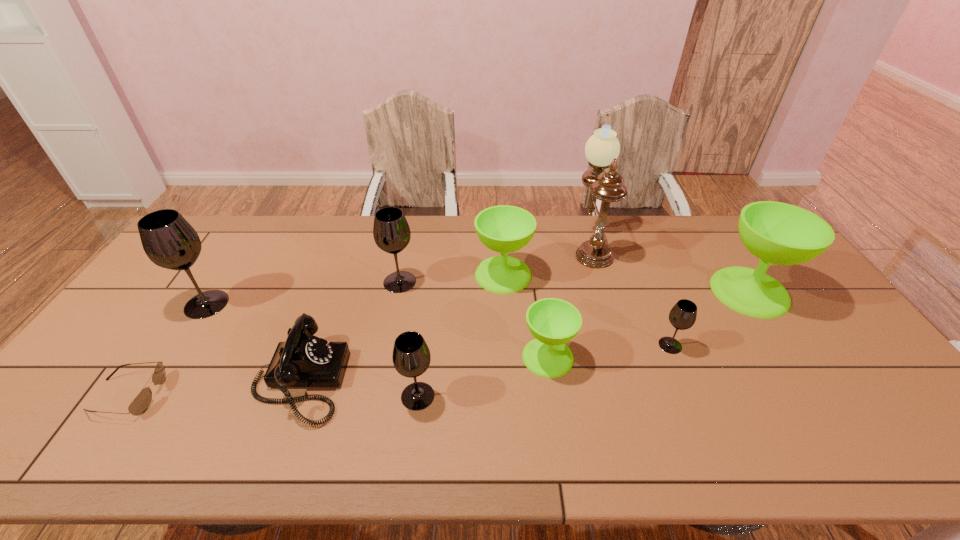
Locate an element on the screen. free spot between the second biggest green wineglass and the telephone is located at coordinates (401, 327).

You are a GUI agent. You are given a task and a screenshot of the screen. Output one action in this format:
    pyautogui.click(x=<x>, y=<y>)
    Task: Click on the empty space between the third farthest gray wineglass and the tallest object
    The image size is (960, 540).
    Given the screenshot: What is the action you would take?
    pyautogui.click(x=631, y=295)

This screenshot has width=960, height=540. In order to click on free space between the rightmost object and the second biggest green wineglass in this screenshot , I will do `click(626, 283)`.

In order to click on empty space between the eighth object from left to right and the third wineglass from left to right in this screenshot , I will do `click(504, 320)`.

Identify which object is located as the second nearest to the sixth wineglass from left to right. Please provide its 2D coordinates. Your answer should be formatted as a tuple, i.e. [(x, y)], where the tuple contains the x and y coordinates of a point satisfying the conditions above.

[(553, 322)]

Select which object appears as the closest to the smallest gray wineglass. Please provide its 2D coordinates. Your answer should be formatted as a tuple, i.e. [(x, y)], where the tuple contains the x and y coordinates of a point satisfying the conditions above.

[(778, 233)]

Where is `the second closest wineglass to the nearest wineglass`? The image size is (960, 540). the second closest wineglass to the nearest wineglass is located at coordinates (391, 231).

Locate which wineglass is the sixth closest to the tallest wineglass. Please provide its 2D coordinates. Your answer should be formatted as a tuple, i.e. [(x, y)], where the tuple contains the x and y coordinates of a point satisfying the conditions above.

[(778, 233)]

Identify which gray wineglass is located as the third nearest to the leftmost gray wineglass. Please provide its 2D coordinates. Your answer should be formatted as a tuple, i.e. [(x, y)], where the tuple contains the x and y coordinates of a point satisfying the conditions above.

[(682, 316)]

Find the location of `gray wineglass that is the fourth closest to the second smallest green wineglass`. gray wineglass that is the fourth closest to the second smallest green wineglass is located at coordinates (169, 241).